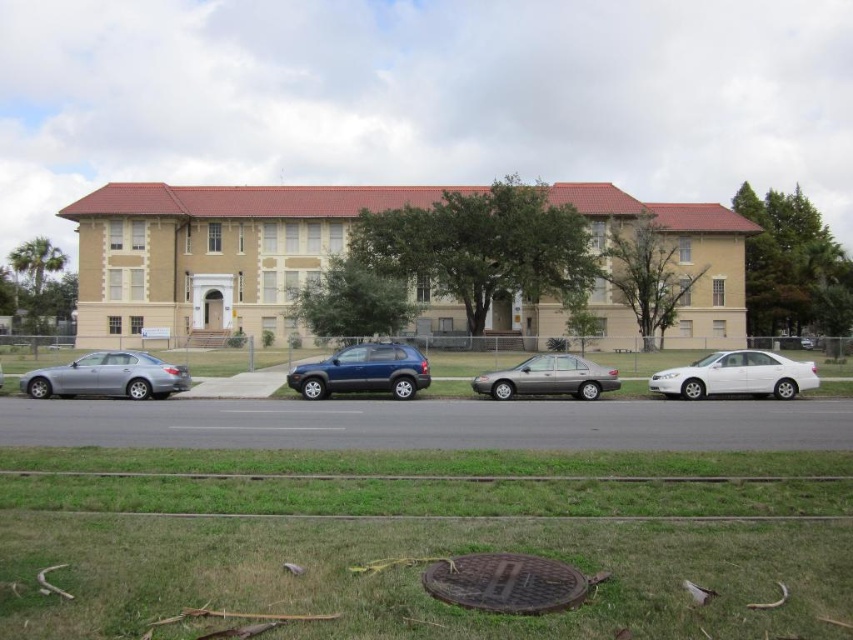
Measure the distance between brown textured manhole cover at lower center and camera.

brown textured manhole cover at lower center is 4.85 meters from camera.

Is point (518, 605) closer to camera compared to point (393, 374)?

Yes.

Between point (585, 582) and point (376, 349), which one is positioned behind?

The point (376, 349) is more distant.

Identify the location of brown textured manhole cover at lower center. Image resolution: width=853 pixels, height=640 pixels. (505, 582).

Is point (511, 586) behind point (669, 371)?

No, it is not.

Does brown textured manhole cover at lower center appear over white glossy sedan at right?

No.

Is point (447, 595) more distant than point (718, 385)?

No, it is in front of (718, 385).

The width and height of the screenshot is (853, 640). Identify the location of brown textured manhole cover at lower center. (505, 582).

Is white glossy sedan at right bigger than satin silver sedan at center?

No.

Between white glossy sedan at right and satin silver sedan at center, which one has less height?

Standing shorter between the two is satin silver sedan at center.

Image resolution: width=853 pixels, height=640 pixels. Describe the element at coordinates (735, 376) in the screenshot. I see `white glossy sedan at right` at that location.

Where is `white glossy sedan at right`? The width and height of the screenshot is (853, 640). white glossy sedan at right is located at coordinates (735, 376).